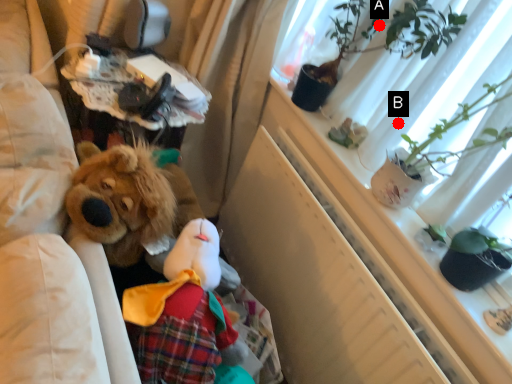
Question: Two points are circled on the image, labeled by A and B beside each circle. Which point is closer to the camera taking this photo?

Choices:
 (A) A is closer
 (B) B is closer

Answer: (B)